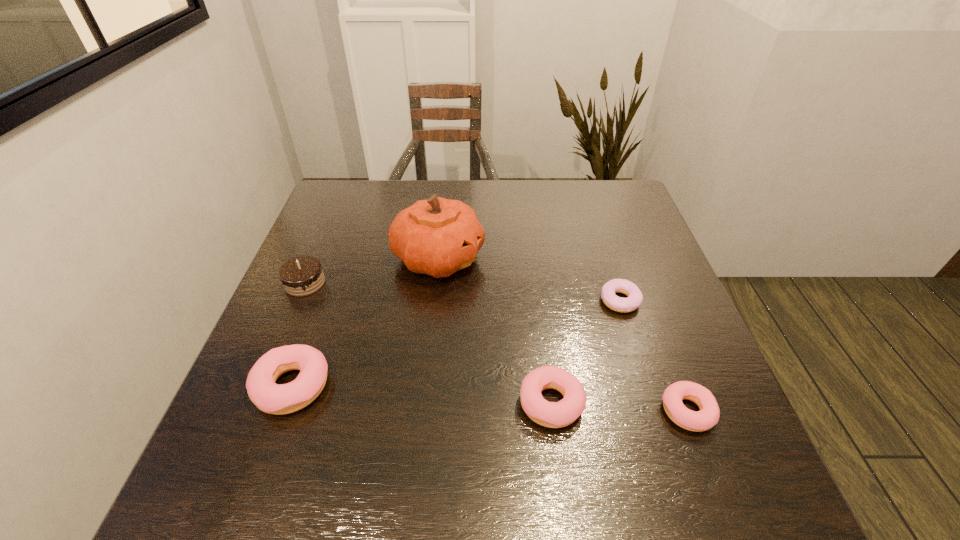
Identify the location of blank space located 0.130m on the front of the farthest doughnut. (639, 362).

The height and width of the screenshot is (540, 960). In order to click on vacant region located on the right of the fifth shortest object in this screenshot , I will do `click(393, 283)`.

Locate an element on the screen. vacant space located on the front-facing side of the tallest object is located at coordinates (567, 258).

Locate an element on the screen. The height and width of the screenshot is (540, 960). doughnut situated at the left edge is located at coordinates (269, 397).

Find the location of a particular element. chocolate cake positioned at the left edge is located at coordinates (301, 276).

Where is `object at the near left corner`? The width and height of the screenshot is (960, 540). object at the near left corner is located at coordinates (269, 397).

You are a GUI agent. You are given a task and a screenshot of the screen. Output one action in this format:
    pyautogui.click(x=<x>, y=<y>)
    Task: Click on the object at the near right corner
    
    Given the screenshot: What is the action you would take?
    pyautogui.click(x=708, y=416)

Identify the location of blank area at the far edge. (395, 180).

The image size is (960, 540). Find the location of `vacant space at the near edge`. vacant space at the near edge is located at coordinates (416, 418).

I want to click on free location at the right edge of the desktop, so [647, 277].